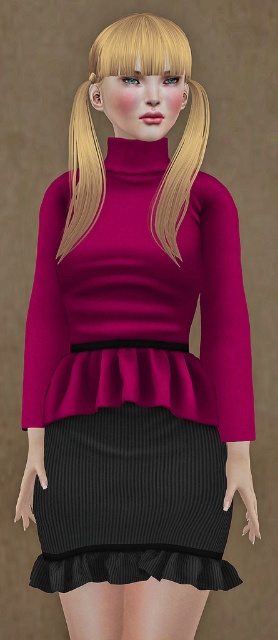
You are a fashion designer observing the outfit of the person in the image. You need to determine the order of the layers from front to back. Which object is positioned in front of the other between the black ribbed skirt at center and the blonde silky hair at upper center?

The black ribbed skirt at center is closer to the viewer than the blonde silky hair at upper center, so the black ribbed skirt at center is positioned in front of the blonde silky hair at upper center.

You are a fashion designer trying to create a layered outfit. You have a matte pink sweater at center and a black ribbed skirt at center. Which item should you place higher on the body to ensure proper layering?

The matte pink sweater at center is taller than the black ribbed skirt at center, so you should place the matte pink sweater at center higher on the body to ensure proper layering.